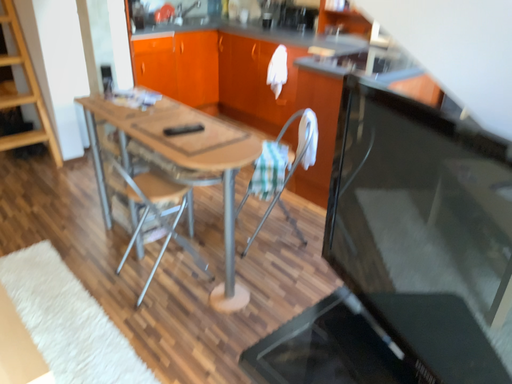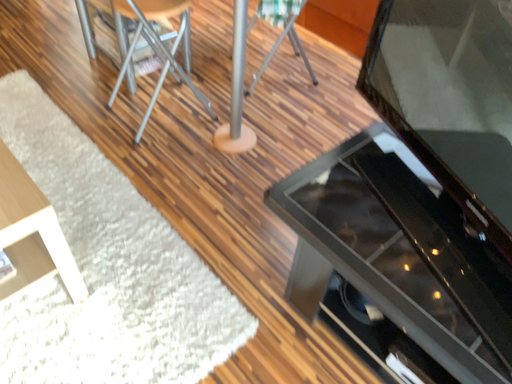
Question: How did the camera likely rotate when shooting the video?

Choices:
 (A) rotated downward
 (B) rotated upward

Answer: (A)